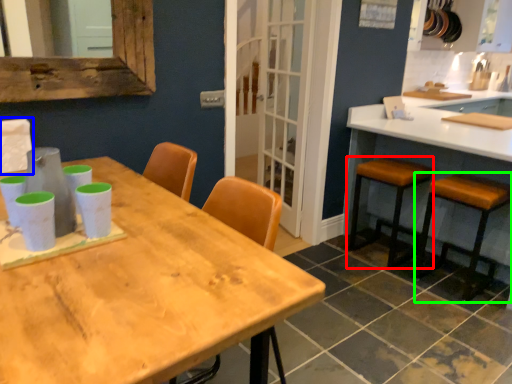
Question: Based on their relative distances, which object is farther from stool (highlighted by a red box)? Choose from chair (highlighted by a blue box) and stool (highlighted by a green box).

Choices:
 (A) chair
 (B) stool

Answer: (A)